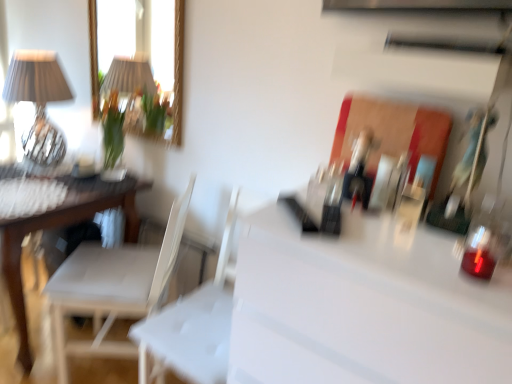
Question: From a real-world perspective, is white plastic swivel chair at center over white glossy counter top at center?

Choices:
 (A) no
 (B) yes

Answer: (A)

Question: Is white plastic swivel chair at center oriented away from white glossy counter top at center?

Choices:
 (A) no
 (B) yes

Answer: (A)

Question: Could white glossy counter top at center be considered to be inside white plastic swivel chair at center?

Choices:
 (A) yes
 (B) no

Answer: (B)

Question: Does white plastic swivel chair at center have a lesser width compared to white glossy counter top at center?

Choices:
 (A) no
 (B) yes

Answer: (B)

Question: Considering the relative sizes of white plastic swivel chair at center and white glossy counter top at center in the image provided, is white plastic swivel chair at center shorter than white glossy counter top at center?

Choices:
 (A) no
 (B) yes

Answer: (B)

Question: Could you tell me if white plastic swivel chair at center is facing white glossy counter top at center?

Choices:
 (A) yes
 (B) no

Answer: (B)

Question: Can you confirm if white fabric chair at left is wider than white glossy counter top at center?

Choices:
 (A) yes
 (B) no

Answer: (B)

Question: Does white fabric chair at left have a lesser width compared to white glossy counter top at center?

Choices:
 (A) yes
 (B) no

Answer: (A)

Question: Does white fabric chair at left have a smaller size compared to white glossy counter top at center?

Choices:
 (A) no
 (B) yes

Answer: (B)

Question: Is white fabric chair at left far from white glossy counter top at center?

Choices:
 (A) no
 (B) yes

Answer: (A)

Question: Does white fabric chair at left have a lesser height compared to white glossy counter top at center?

Choices:
 (A) no
 (B) yes

Answer: (B)

Question: From the image's perspective, is white fabric chair at left on white glossy counter top at center?

Choices:
 (A) yes
 (B) no

Answer: (A)

Question: Is white plastic swivel chair at center taller than matte glass table lamp at upper left?

Choices:
 (A) yes
 (B) no

Answer: (A)